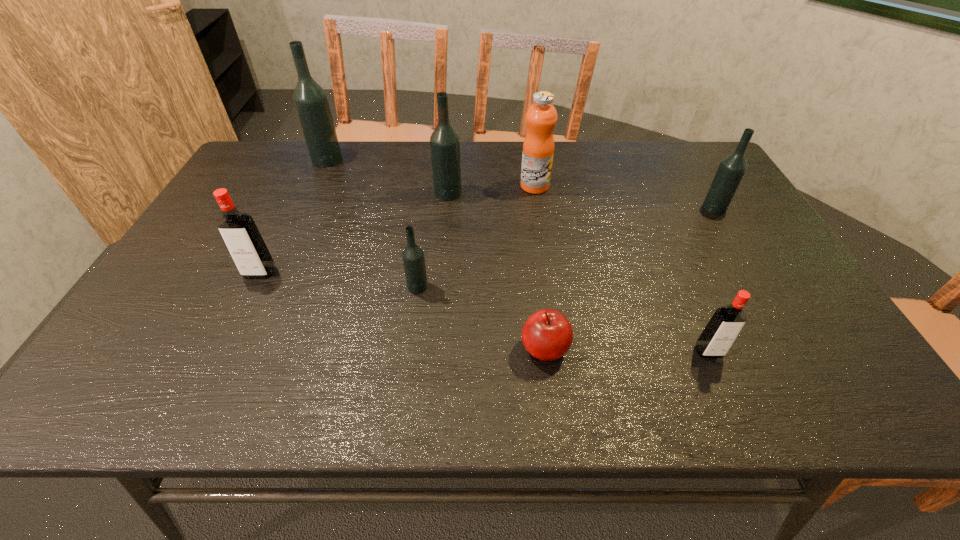
The width and height of the screenshot is (960, 540). What are the coordinates of `free space between the farther red vodka and the rightmost black vodka` in the screenshot? It's located at (487, 240).

Locate an element on the screen. The height and width of the screenshot is (540, 960). free space between the second tallest vodka and the tallest vodka is located at coordinates (388, 176).

At what (x,y) coordinates should I click in order to perform the action: click on unoccupied area between the farther red vodka and the smallest black vodka. Please return your answer as a coordinate pair (x, y). The width and height of the screenshot is (960, 540). Looking at the image, I should click on (339, 280).

Locate an element on the screen. The height and width of the screenshot is (540, 960). vacant region between the left red vodka and the pink apple is located at coordinates (402, 310).

Locate an element on the screen. This screenshot has height=540, width=960. empty location between the right red vodka and the third smallest black vodka is located at coordinates (578, 272).

This screenshot has width=960, height=540. I want to click on free area in between the rightmost black vodka and the bigger red vodka, so click(x=487, y=240).

The height and width of the screenshot is (540, 960). In order to click on free space between the fruit juice and the rightmost black vodka in this screenshot , I will do `click(625, 197)`.

Locate an element on the screen. The height and width of the screenshot is (540, 960). object that is the sixth closest to the tallest vodka is located at coordinates (731, 170).

At what (x,y) coordinates should I click in order to perform the action: click on object that ranks as the seventh closest to the second smallest black vodka. Please return your answer as a coordinate pair (x, y). The height and width of the screenshot is (540, 960). Looking at the image, I should click on (238, 229).

Identify the location of vodka that is the fifth nearest to the nearer red vodka. (311, 102).